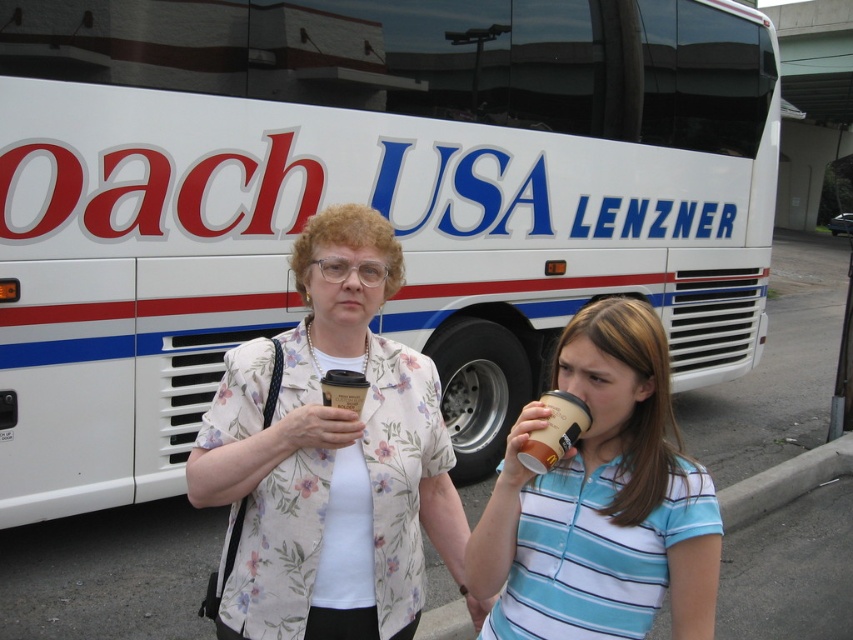
Who is more forward, (573, 484) or (550, 397)?

Point (550, 397) is in front.

Which is more to the left, striped cotton shirt at lower right or brown paper cup at center?

Positioned to the left is brown paper cup at center.

Which is in front, point (709, 625) or point (544, 436)?

Positioned in front is point (544, 436).

This screenshot has height=640, width=853. Identify the location of striped cotton shirt at lower right. (601, 500).

Who is more forward, (x=432, y=444) or (x=563, y=436)?

Point (x=563, y=436) is in front.

Which is more to the left, floral fabric blouse at center or brown paper cup at center?

From the viewer's perspective, floral fabric blouse at center appears more on the left side.

The width and height of the screenshot is (853, 640). Find the location of `floral fabric blouse at center`. floral fabric blouse at center is located at coordinates (332, 458).

The height and width of the screenshot is (640, 853). What are the coordinates of `floral fabric blouse at center` in the screenshot? It's located at (332, 458).

Can you confirm if floral fabric blouse at center is positioned to the left of striped cotton shirt at lower right?

Yes, floral fabric blouse at center is to the left of striped cotton shirt at lower right.

Describe the element at coordinates (332, 458) in the screenshot. This screenshot has height=640, width=853. I see `floral fabric blouse at center` at that location.

Find the location of a particular element. This screenshot has width=853, height=640. floral fabric blouse at center is located at coordinates (332, 458).